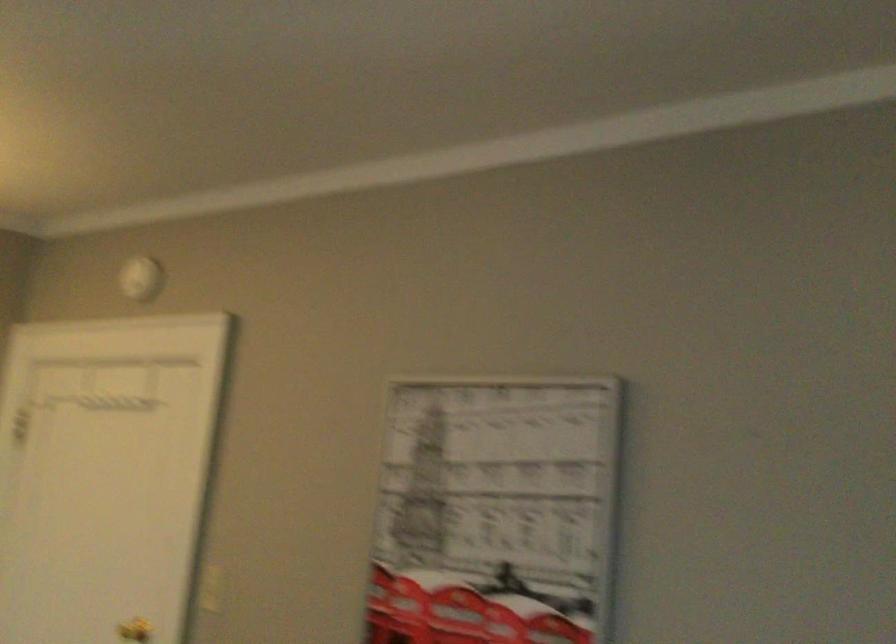
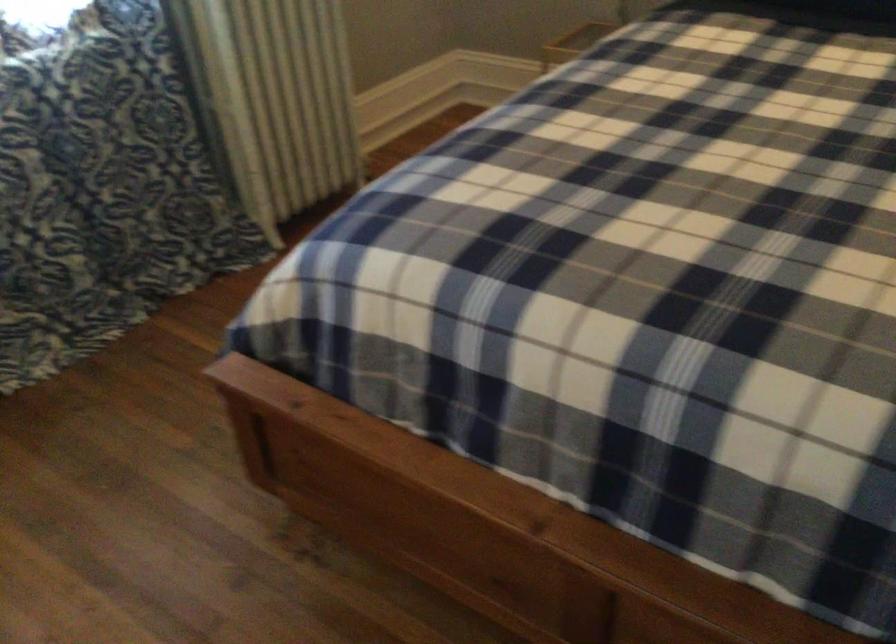
The first image is from the beginning of the video and the second image is from the end. How did the camera likely rotate when shooting the video?

The rotation direction of the camera is left-down.